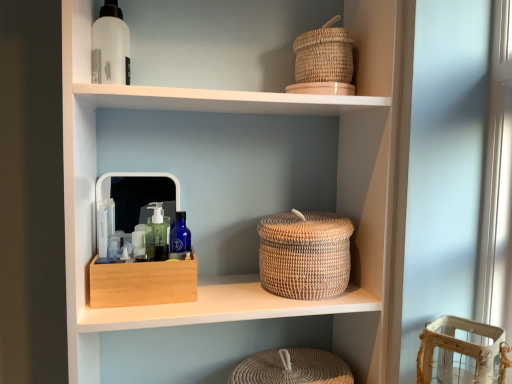
Describe the element at coordinates (143, 283) in the screenshot. I see `beech wood storage box at center` at that location.

Describe the element at coordinates (251, 113) in the screenshot. I see `natural woven basket at center` at that location.

Measure the distance between natural woven basket at center and camera.

natural woven basket at center is 31.57 inches away from camera.

What is the approximate height of woven beige basket at lower right, the first basket when ordered from bottom to top?

8.61 inches.

Describe the element at coordinates (324, 55) in the screenshot. I see `woven natural basket at upper right, which ranks as the 3th basket in bottom-to-top order` at that location.

Find the location of a particular element. beech wood storage box at center is located at coordinates (143, 283).

Between woven natural basket at upper right, which ranks as the 3th basket in bottom-to-top order, and natural woven basket at center, which one has smaller size?

woven natural basket at upper right, which ranks as the 3th basket in bottom-to-top order, is smaller.

Is natural woven basket at center located within woven natural basket at upper right, which ranks as the 3th basket in bottom-to-top order?

No, natural woven basket at center is not surrounded by woven natural basket at upper right, which ranks as the 3th basket in bottom-to-top order.

Does point (339, 59) lie behind point (357, 342)?

That is False.

How different are the orientations of woven natural basket at upper right, which ranks as the 3th basket in bottom-to-top order, and natural woven basket at center in degrees?

The angular difference between woven natural basket at upper right, which ranks as the 3th basket in bottom-to-top order, and natural woven basket at center is 1.49 degrees.

This screenshot has width=512, height=384. Identify the location of basket behind the woven beige basket at center, which is the 2th basket in bottom-to-top order. (324, 55).

Is woven beige basket at center, which is the 2th basket in bottom-to-top order, beside woven natural basket at upper right, which ranks as the 3th basket in bottom-to-top order?

woven beige basket at center, which is the 2th basket in bottom-to-top order, and woven natural basket at upper right, which ranks as the 3th basket in bottom-to-top order, are clearly separated.

Consider the image. Considering the sizes of objects woven beige basket at center, which is the 2th basket in bottom-to-top order, and woven natural basket at upper right, marked as the 1th basket in a top-to-bottom arrangement, in the image provided, who is bigger, woven beige basket at center, which is the 2th basket in bottom-to-top order, or woven natural basket at upper right, marked as the 1th basket in a top-to-bottom arrangement,?

With larger size is woven beige basket at center, which is the 2th basket in bottom-to-top order.

Does woven beige basket at center, which is the 2th basket in bottom-to-top order, turn towards beech wood storage box at center?

No, woven beige basket at center, which is the 2th basket in bottom-to-top order, is not aimed at beech wood storage box at center.

At what (x,y) coordinates should I click in order to perform the action: click on basket that is the 1st object above the beech wood storage box at center (from a real-world perspective). Please return your answer as a coordinate pair (x, y). Image resolution: width=512 pixels, height=384 pixels. Looking at the image, I should click on (305, 255).

From a real-world perspective, is woven beige basket at center, the 2th basket viewed from the top, beneath beech wood storage box at center?

No, from a real-world perspective, woven beige basket at center, the 2th basket viewed from the top, is not under beech wood storage box at center.

Between woven beige basket at center, the 2th basket viewed from the top, and beech wood storage box at center, which one has smaller size?

beech wood storage box at center is smaller.

How different are the orientations of natural woven basket at center and woven beige basket at center, which is the 2th basket in bottom-to-top order, in degrees?

0.22 degrees.

Considering the sizes of objects natural woven basket at center and woven beige basket at center, the 2th basket viewed from the top, in the image provided, who is smaller, natural woven basket at center or woven beige basket at center, the 2th basket viewed from the top,?

woven beige basket at center, the 2th basket viewed from the top, is smaller.

Considering the sizes of objects natural woven basket at center and woven beige basket at center, which is the 2th basket in bottom-to-top order, in the image provided, who is thinner, natural woven basket at center or woven beige basket at center, which is the 2th basket in bottom-to-top order,?

woven beige basket at center, which is the 2th basket in bottom-to-top order, is thinner.

Which of these two, natural woven basket at center or woven beige basket at center, the 2th basket viewed from the top, stands shorter?

woven beige basket at center, the 2th basket viewed from the top, is shorter.

Do you think beech wood storage box at center is within natural woven basket at center, or outside of it?

beech wood storage box at center is inside natural woven basket at center.

Consider the image. Is beech wood storage box at center far away from natural woven basket at center?

That's not correct — beech wood storage box at center is a little close to natural woven basket at center.

Who is shorter, beech wood storage box at center or natural woven basket at center?

beech wood storage box at center is shorter.

Is the surface of beech wood storage box at center in direct contact with woven beige basket at center, which is the 2th basket in bottom-to-top order?

No, beech wood storage box at center is not touching woven beige basket at center, which is the 2th basket in bottom-to-top order.

Which is in front, beech wood storage box at center or woven beige basket at center, the 2th basket viewed from the top?

beech wood storage box at center is closer to the camera.

Does beech wood storage box at center have a lesser height compared to woven beige basket at center, the 2th basket viewed from the top?

Yes, beech wood storage box at center is shorter than woven beige basket at center, the 2th basket viewed from the top.

Is beech wood storage box at center wider or thinner than woven beige basket at center, the 2th basket viewed from the top?

Considering their sizes, beech wood storage box at center looks slimmer than woven beige basket at center, the 2th basket viewed from the top.

Looking at this image, from a real-world perspective, which is physically below, woven natural basket at upper right, which ranks as the 3th basket in bottom-to-top order, or beech wood storage box at center?

In real-world perspective, beech wood storage box at center is lower.

Is beech wood storage box at center at the back of woven natural basket at upper right, marked as the 1th basket in a top-to-bottom arrangement?

woven natural basket at upper right, marked as the 1th basket in a top-to-bottom arrangement, does not have its back to beech wood storage box at center.

Which object is wider, woven natural basket at upper right, marked as the 1th basket in a top-to-bottom arrangement, or beech wood storage box at center?

beech wood storage box at center is wider.

The width and height of the screenshot is (512, 384). Find the location of `shelf that is on the left side of woven natural basket at upper right, marked as the 1th basket in a top-to-bottom arrangement`. shelf that is on the left side of woven natural basket at upper right, marked as the 1th basket in a top-to-bottom arrangement is located at coordinates (251, 113).

This screenshot has height=384, width=512. Find the location of `basket lying above the woven beige basket at center, the 2th basket viewed from the top (from the image's perspective)`. basket lying above the woven beige basket at center, the 2th basket viewed from the top (from the image's perspective) is located at coordinates (324, 55).

From the image, which object appears to be farther from natural woven basket at center, woven beige basket at lower right, the 3th basket viewed from the top, or beech wood storage box at center?

The object further to natural woven basket at center is woven beige basket at lower right, the 3th basket viewed from the top.

Looking at the image, which one is located further to beech wood storage box at center, woven natural basket at upper right, marked as the 1th basket in a top-to-bottom arrangement, or woven beige basket at center, the 2th basket viewed from the top?

Based on the image, woven natural basket at upper right, marked as the 1th basket in a top-to-bottom arrangement, appears to be further to beech wood storage box at center.

Looking at the image, which one is located further to woven beige basket at center, which is the 2th basket in bottom-to-top order, woven beige basket at lower right, the first basket when ordered from bottom to top, or beech wood storage box at center?

Based on the image, woven beige basket at lower right, the first basket when ordered from bottom to top, appears to be further to woven beige basket at center, which is the 2th basket in bottom-to-top order.

When comparing their distances from beech wood storage box at center, does woven beige basket at lower right, the first basket when ordered from bottom to top, or woven beige basket at center, which is the 2th basket in bottom-to-top order, seem further?

The object further to beech wood storage box at center is woven beige basket at lower right, the first basket when ordered from bottom to top.

From the image, which object appears to be farther from beech wood storage box at center, woven beige basket at lower right, the first basket when ordered from bottom to top, or woven natural basket at upper right, which ranks as the 3th basket in bottom-to-top order?

woven natural basket at upper right, which ranks as the 3th basket in bottom-to-top order, is positioned further to the anchor beech wood storage box at center.

Considering their positions, is beech wood storage box at center positioned further to woven natural basket at upper right, marked as the 1th basket in a top-to-bottom arrangement, than woven beige basket at lower right, the 3th basket viewed from the top?

woven beige basket at lower right, the 3th basket viewed from the top, is further to woven natural basket at upper right, marked as the 1th basket in a top-to-bottom arrangement.

Based on the photo, when comparing their distances from beech wood storage box at center, does woven beige basket at center, which is the 2th basket in bottom-to-top order, or woven beige basket at lower right, the 3th basket viewed from the top, seem closer?

woven beige basket at center, which is the 2th basket in bottom-to-top order, is positioned closer to the anchor beech wood storage box at center.

Which object lies nearer to the anchor point woven beige basket at center, which is the 2th basket in bottom-to-top order, natural woven basket at center or woven natural basket at upper right, which ranks as the 3th basket in bottom-to-top order?

natural woven basket at center.

This screenshot has width=512, height=384. I want to click on shelf located between beech wood storage box at center and woven beige basket at center, the 2th basket viewed from the top, in the left-right direction, so click(x=251, y=113).

The height and width of the screenshot is (384, 512). I want to click on shelf between beech wood storage box at center and woven beige basket at lower right, the first basket when ordered from bottom to top, from left to right, so click(251, 113).

You are a GUI agent. You are given a task and a screenshot of the screen. Output one action in this format:
    pyautogui.click(x=<x>, y=<y>)
    Task: Click on the basket between woven natural basket at upper right, marked as the 1th basket in a top-to-bottom arrangement, and beech wood storage box at center, in the vertical direction
    
    Given the screenshot: What is the action you would take?
    pyautogui.click(x=305, y=255)

Image resolution: width=512 pixels, height=384 pixels. Find the location of `storage box between woven natural basket at upper right, which ranks as the 3th basket in bottom-to-top order, and woven beige basket at lower right, the 3th basket viewed from the top, in the up-down direction`. storage box between woven natural basket at upper right, which ranks as the 3th basket in bottom-to-top order, and woven beige basket at lower right, the 3th basket viewed from the top, in the up-down direction is located at coordinates (143, 283).